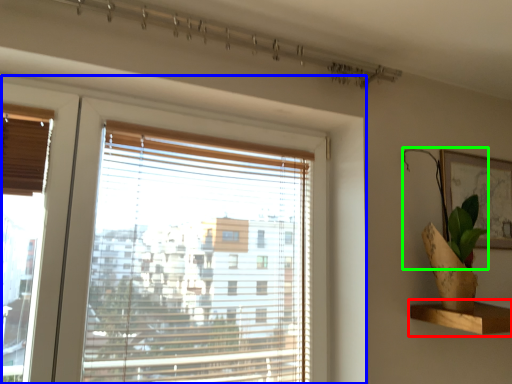
Question: Which is farther away from shelf (highlighted by a red box)? window (highlighted by a blue box) or plant (highlighted by a green box)?

Choices:
 (A) window
 (B) plant

Answer: (A)